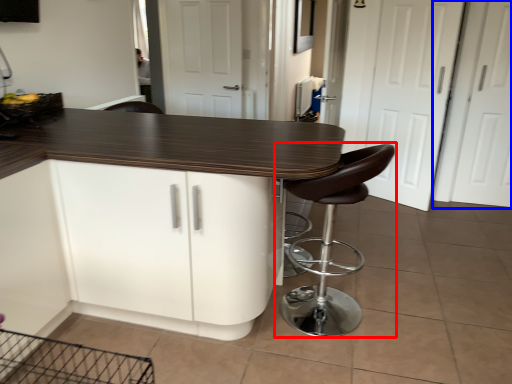
Question: Which object is further to the camera taking this photo, chair (highlighted by a red box) or screen door (highlighted by a blue box)?

Choices:
 (A) chair
 (B) screen door

Answer: (B)